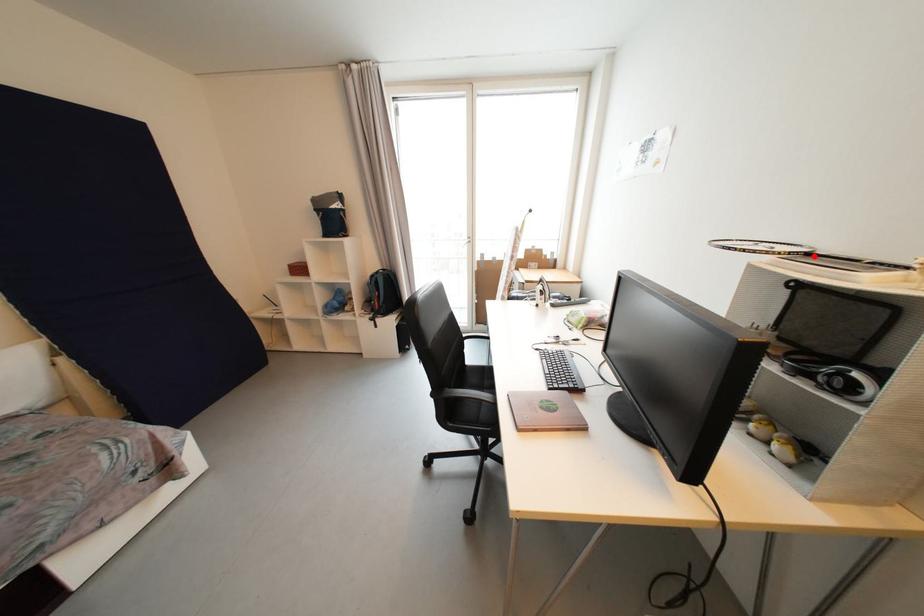
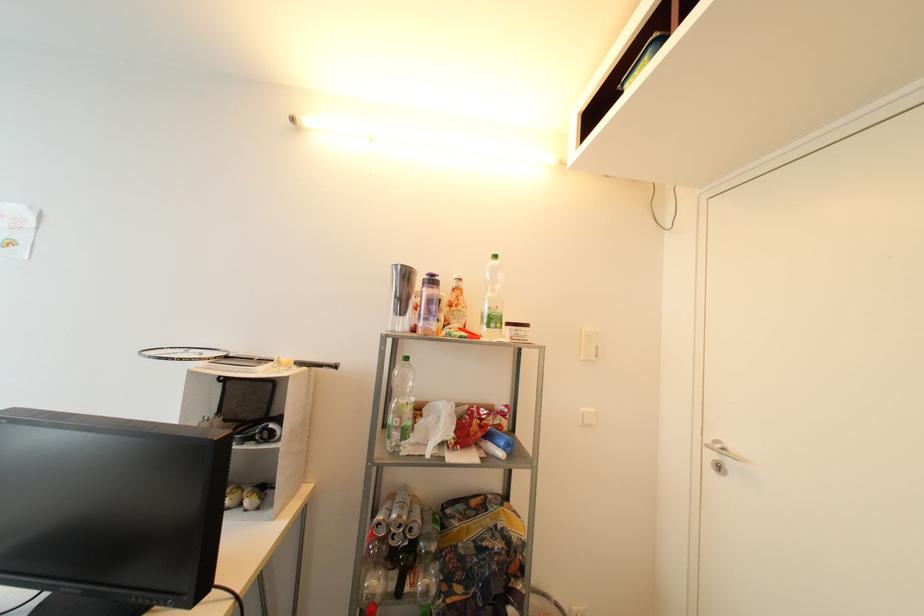
Where in the second image is the point corresponding to the highlighted location from the first image?

(232, 359)